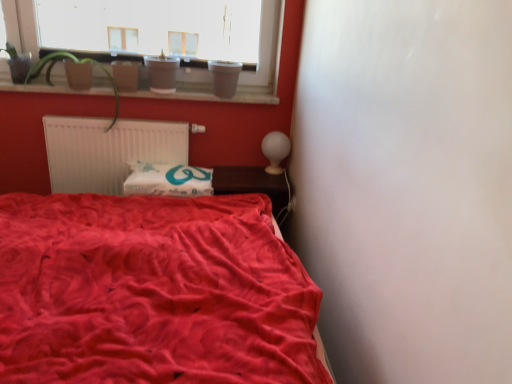
Question: Is velvet red bed at lower left further to camera compared to smooth wooden window sill at upper center?

Choices:
 (A) yes
 (B) no

Answer: (B)

Question: Is velvet red bed at lower left surrounding smooth wooden window sill at upper center?

Choices:
 (A) no
 (B) yes

Answer: (A)

Question: Is velvet red bed at lower left wider than smooth wooden window sill at upper center?

Choices:
 (A) no
 (B) yes

Answer: (B)

Question: Is velvet red bed at lower left to the left of smooth wooden window sill at upper center from the viewer's perspective?

Choices:
 (A) yes
 (B) no

Answer: (B)

Question: Could you tell me if velvet red bed at lower left is facing smooth wooden window sill at upper center?

Choices:
 (A) no
 (B) yes

Answer: (A)

Question: Do you think green matte plant at upper left is within velvet red bed at lower left, or outside of it?

Choices:
 (A) inside
 (B) outside

Answer: (B)

Question: Considering the positions of green matte plant at upper left and velvet red bed at lower left in the image, is green matte plant at upper left bigger or smaller than velvet red bed at lower left?

Choices:
 (A) small
 (B) big

Answer: (A)

Question: From the image's perspective, is green matte plant at upper left located above or below velvet red bed at lower left?

Choices:
 (A) below
 (B) above

Answer: (B)

Question: From a real-world perspective, relative to velvet red bed at lower left, is green matte plant at upper left vertically above or below?

Choices:
 (A) above
 (B) below

Answer: (A)

Question: Considering the positions of white paper at center and brown wooden table at center in the image, is white paper at center bigger or smaller than brown wooden table at center?

Choices:
 (A) small
 (B) big

Answer: (B)

Question: From a real-world perspective, is white paper at center physically located above or below brown wooden table at center?

Choices:
 (A) below
 (B) above

Answer: (B)

Question: Considering the positions of white paper at center and brown wooden table at center in the image, is white paper at center wider or thinner than brown wooden table at center?

Choices:
 (A) wide
 (B) thin

Answer: (B)

Question: Relative to brown wooden table at center, is white paper at center in front or behind?

Choices:
 (A) front
 (B) behind

Answer: (A)

Question: In the image, is velvet red bed at lower left positioned in front of or behind white plastic window at upper left?

Choices:
 (A) front
 (B) behind

Answer: (A)

Question: From the image's perspective, is velvet red bed at lower left above or below white plastic window at upper left?

Choices:
 (A) below
 (B) above

Answer: (A)